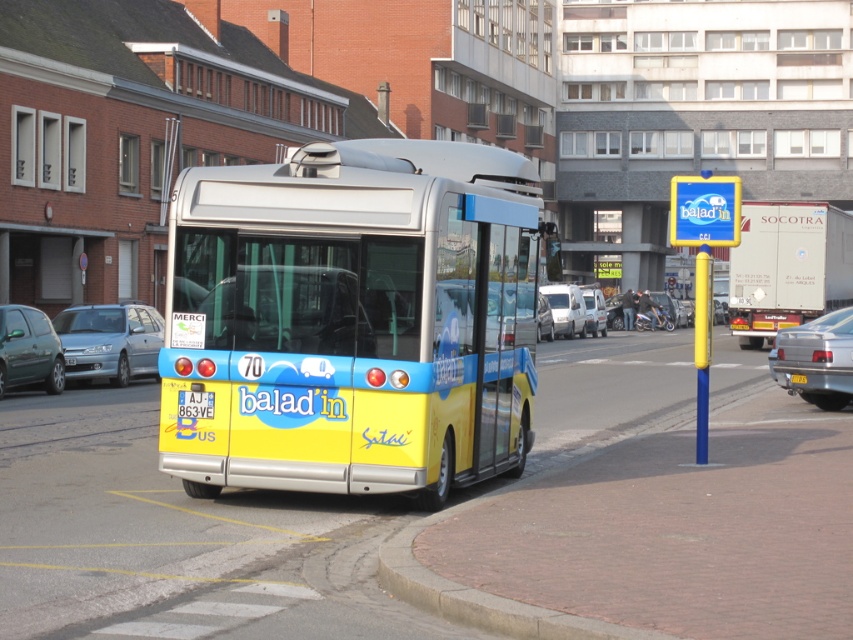
Does blue plastic sign at upper right appear over metallic green hatchback at left?

Yes, blue plastic sign at upper right is above metallic green hatchback at left.

Does blue plastic sign at upper right come behind metallic green hatchback at left?

That is False.

Where is `blue plastic sign at upper right`? This screenshot has width=853, height=640. blue plastic sign at upper right is located at coordinates (703, 262).

The image size is (853, 640). Identify the location of blue plastic sign at upper right. (703, 262).

Can you confirm if blue plastic sign at upper right is taller than yellow matte license plate at center?

Yes.

Who is more distant from viewer, (704, 216) or (190, 397)?

Positioned behind is point (704, 216).

Where is `blue plastic sign at upper right`? Image resolution: width=853 pixels, height=640 pixels. blue plastic sign at upper right is located at coordinates (703, 262).

Can you confirm if silver metallic sedan at right is bigger than white matte van at center?

No, silver metallic sedan at right is not bigger than white matte van at center.

Does point (827, 333) come behind point (601, 316)?

No, (827, 333) is closer to viewer.

Locate an element on the screen. The height and width of the screenshot is (640, 853). silver metallic sedan at right is located at coordinates (816, 358).